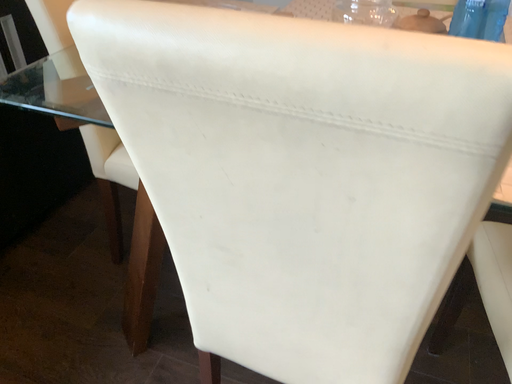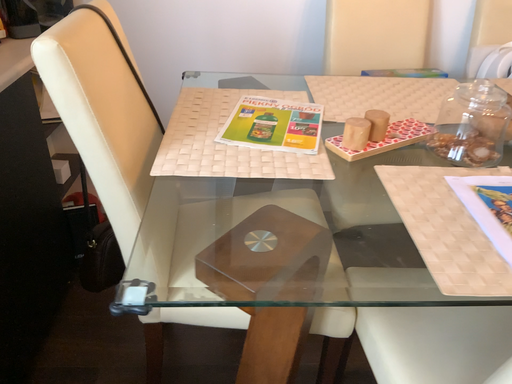
Question: How did the camera likely rotate when shooting the video?

Choices:
 (A) rotated downward
 (B) rotated upward

Answer: (B)